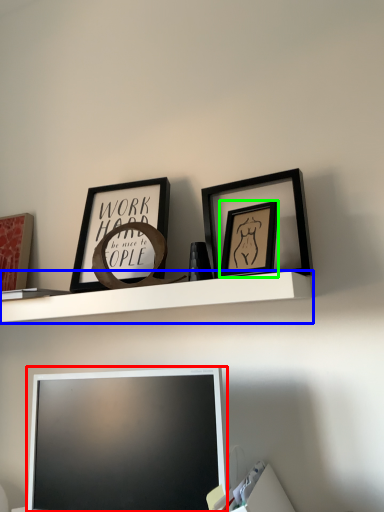
Question: Which object is positioned closest to television (highlighted by a red box)? Select from shelf (highlighted by a blue box) and picture frame (highlighted by a green box).

Choices:
 (A) shelf
 (B) picture frame

Answer: (A)